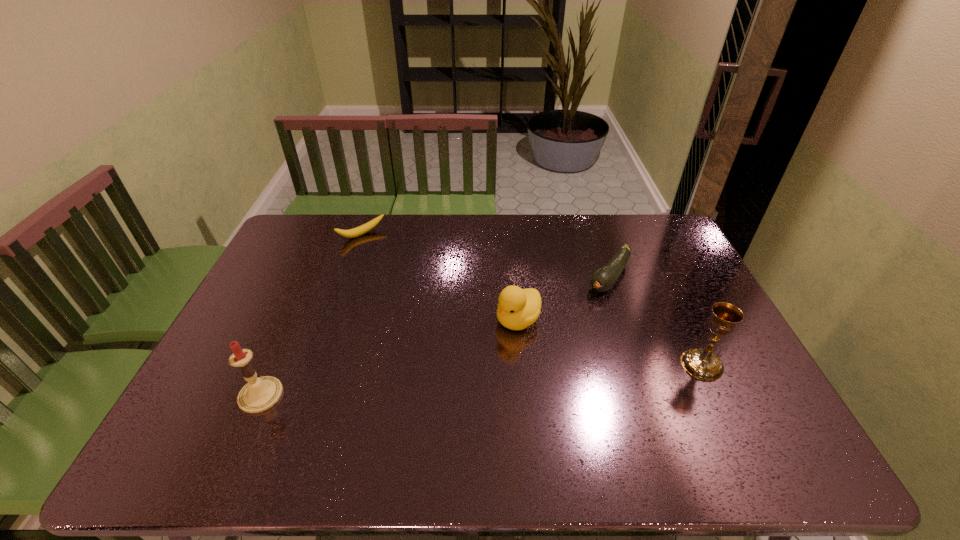
Locate an element on the screen. The width and height of the screenshot is (960, 540). candle is located at coordinates (260, 394).

Locate an element on the screen. chalice is located at coordinates (703, 364).

Locate an element on the screen. The image size is (960, 540). the second farthest object is located at coordinates point(605,278).

You are a GUI agent. You are given a task and a screenshot of the screen. Output one action in this format:
    pyautogui.click(x=<x>, y=<y>)
    Task: Click on the second object from right to left
    The height and width of the screenshot is (540, 960).
    Given the screenshot: What is the action you would take?
    pyautogui.click(x=605, y=278)

This screenshot has height=540, width=960. What are the coordinates of `the third tallest object` in the screenshot? It's located at (518, 308).

Identify the location of duck. tap(518, 308).

The image size is (960, 540). What are the coordinates of `the farthest object` in the screenshot? It's located at (360, 230).

You are a GUI agent. You are given a task and a screenshot of the screen. Output one action in this format:
    pyautogui.click(x=<x>, y=<y>)
    Task: Click on the free space located on the right of the candle
    The width and height of the screenshot is (960, 540).
    Given the screenshot: What is the action you would take?
    pyautogui.click(x=373, y=395)

Where is `vacant space located on the front of the chalice`? vacant space located on the front of the chalice is located at coordinates (728, 420).

Where is `vacant space situated 0.160m at the blossom end of the second farthest object`? Image resolution: width=960 pixels, height=540 pixels. vacant space situated 0.160m at the blossom end of the second farthest object is located at coordinates (572, 324).